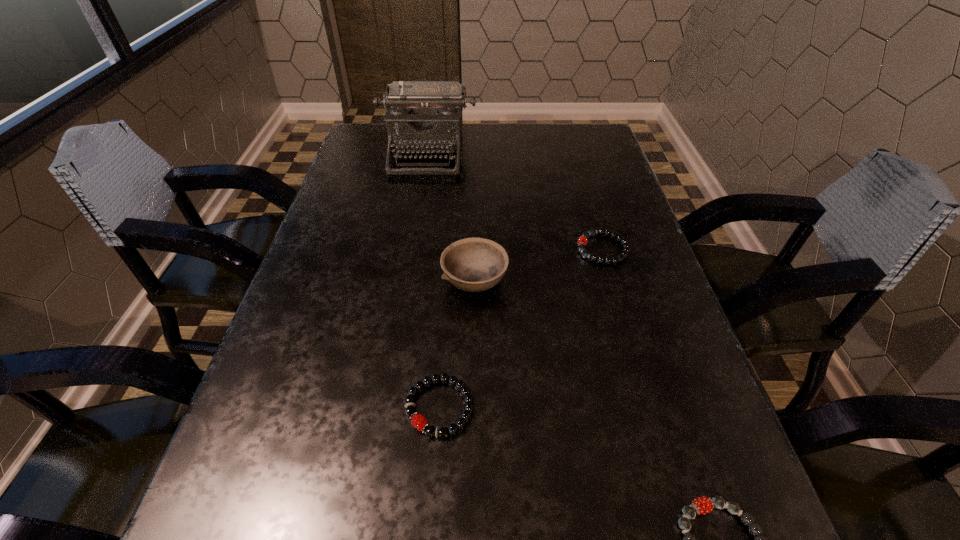
Where is `object located at the far edge`? Image resolution: width=960 pixels, height=540 pixels. object located at the far edge is located at coordinates (423, 117).

Locate an element on the screen. object that is at the left edge is located at coordinates (423, 117).

The width and height of the screenshot is (960, 540). I want to click on object positioned at the right edge, so click(582, 241).

Where is `object that is at the far left corner`? The width and height of the screenshot is (960, 540). object that is at the far left corner is located at coordinates [x=423, y=117].

Find the location of `free location at the far edge`. free location at the far edge is located at coordinates (529, 130).

Find the location of `vacant region at the left edge of the desktop`. vacant region at the left edge of the desktop is located at coordinates [383, 200].

Locate an element on the screen. vacant area at the right edge is located at coordinates (660, 435).

In the image, there is a desktop. Identify the location of vacant space at the far right corner. The height and width of the screenshot is (540, 960). (596, 134).

At what (x,y) coordinates should I click in order to perform the action: click on vacant point located between the farthest bracelet and the fourth farthest object. Please return your answer as a coordinate pair (x, y). The height and width of the screenshot is (540, 960). Looking at the image, I should click on [x=521, y=328].

This screenshot has width=960, height=540. I want to click on empty space that is in between the bowl and the farthest bracelet, so click(539, 266).